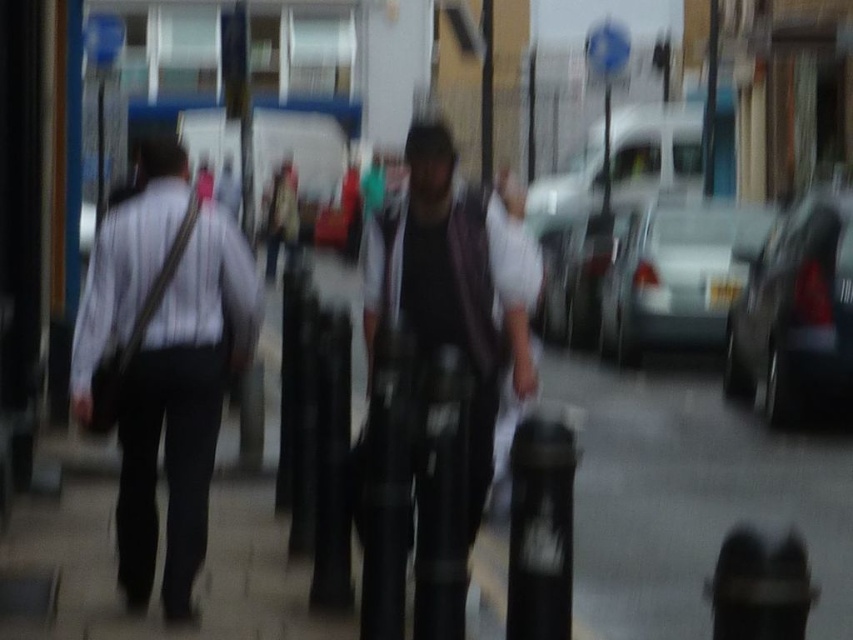
You are a photographer who wants to capture a clear image of the dark gray fabric jacket at center and the silver metallic sedan at center. Given the current blurred image, which object would be easier to focus on if you adjust your camera settings to reduce motion blur?

The silver metallic sedan at center would be easier to focus on because it has a greater width than the dark gray fabric jacket at center, making it a larger target for the camera to capture clearly.

You are a pedestrian standing on the sidewalk and you see the dark gray fabric jacket at center and the silver metallic sedan at center. Which object is positioned to the left when viewed from your perspective?

The dark gray fabric jacket at center is positioned to the left of the silver metallic sedan at center.

You are a photographer who just took a blurry photo of a street scene. In your photo, there are two objects of interest labeled as the white striped shirt at left and the shiny black car at right. Based on the blurriness, can you determine which object is closer to the camera?

The white striped shirt at left appears larger in width compared to the shiny black car at right, which suggests it is closer to the camera since objects closer to the lens appear larger in the photo.